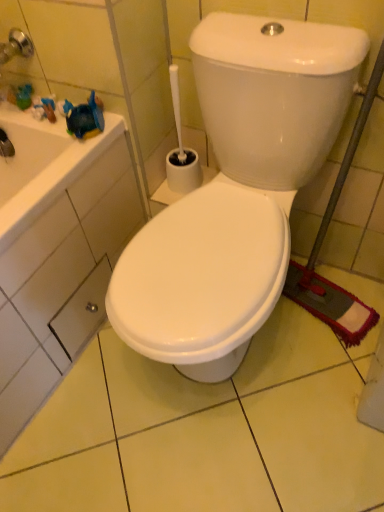
At what (x,y) coordinates should I click in order to perform the action: click on metallic silver drawer at lower left. Please return your answer as a coordinate pair (x, y). The width and height of the screenshot is (384, 512). Looking at the image, I should click on (82, 311).

What do you see at coordinates (82, 311) in the screenshot? I see `metallic silver drawer at lower left` at bounding box center [82, 311].

Locate an element on the screen. The image size is (384, 512). white glossy toilet at center is located at coordinates (236, 191).

What do you see at coordinates (236, 191) in the screenshot? I see `white glossy toilet at center` at bounding box center [236, 191].

Identify the location of metallic silver drawer at lower left. (82, 311).

Considering the positions of objects metallic silver drawer at lower left and white glossy toilet at center in the image provided, who is more to the right, metallic silver drawer at lower left or white glossy toilet at center?

white glossy toilet at center.

Is the depth of metallic silver drawer at lower left greater than that of white glossy toilet at center?

Yes, metallic silver drawer at lower left is further from the viewer.

Which point is more forward, (87, 288) or (266, 244)?

The point (266, 244) is closer to the camera.

From the image's perspective, is metallic silver drawer at lower left located above or below white glossy toilet at center?

metallic silver drawer at lower left is below white glossy toilet at center.

From a real-world perspective, is metallic silver drawer at lower left located higher than white glossy toilet at center?

Actually, metallic silver drawer at lower left is physically below white glossy toilet at center in the real world.

Between metallic silver drawer at lower left and white glossy toilet at center, which one has smaller width?

Thinner between the two is metallic silver drawer at lower left.

Can you confirm if metallic silver drawer at lower left is shorter than white glossy toilet at center?

Yes, metallic silver drawer at lower left is shorter than white glossy toilet at center.

Consider the image. Considering the relative sizes of metallic silver drawer at lower left and white glossy toilet at center in the image provided, is metallic silver drawer at lower left bigger than white glossy toilet at center?

No.

Is metallic silver drawer at lower left not within white glossy toilet at center?

Yes, metallic silver drawer at lower left is located beyond the bounds of white glossy toilet at center.

From the picture: Is metallic silver drawer at lower left placed right next to white glossy toilet at center?

No, metallic silver drawer at lower left is not with white glossy toilet at center.

Looking at this image, is metallic silver drawer at lower left looking in the opposite direction of white glossy toilet at center?

metallic silver drawer at lower left does not have its back to white glossy toilet at center.

What's the angular difference between metallic silver drawer at lower left and white glossy toilet at center's facing directions?

They differ by 88.9 degrees in their facing directions.

How far apart are metallic silver drawer at lower left and white glossy toilet at center?

18.16 inches.

The width and height of the screenshot is (384, 512). Identify the location of toilet lying above the metallic silver drawer at lower left (from the image's perspective). (236, 191).

Considering the positions of objects white glossy toilet at center and metallic silver drawer at lower left in the image provided, who is more to the right, white glossy toilet at center or metallic silver drawer at lower left?

Positioned to the right is white glossy toilet at center.

Is white glossy toilet at center behind metallic silver drawer at lower left?

No, the depth of white glossy toilet at center is less than that of metallic silver drawer at lower left.

Which is behind, point (268, 251) or point (81, 287)?

The point (81, 287) is farther.

From the image's perspective, which one is positioned higher, white glossy toilet at center or metallic silver drawer at lower left?

white glossy toilet at center is shown above in the image.

From a real-world perspective, is white glossy toilet at center located higher than metallic silver drawer at lower left?

Indeed, from a real-world perspective, white glossy toilet at center stands above metallic silver drawer at lower left.

Considering the relative sizes of white glossy toilet at center and metallic silver drawer at lower left in the image provided, is white glossy toilet at center wider than metallic silver drawer at lower left?

Correct, the width of white glossy toilet at center exceeds that of metallic silver drawer at lower left.

Between white glossy toilet at center and metallic silver drawer at lower left, which one has less height?

With less height is metallic silver drawer at lower left.

Does white glossy toilet at center have a larger size compared to metallic silver drawer at lower left?

Correct, white glossy toilet at center is larger in size than metallic silver drawer at lower left.

Is white glossy toilet at center outside of metallic silver drawer at lower left?

Yes, white glossy toilet at center is not within metallic silver drawer at lower left.

Is white glossy toilet at center next to metallic silver drawer at lower left?

white glossy toilet at center and metallic silver drawer at lower left are clearly separated.

Is white glossy toilet at center facing away from metallic silver drawer at lower left?

white glossy toilet at center is not turned away from metallic silver drawer at lower left.

How different are the orientations of white glossy toilet at center and metallic silver drawer at lower left in degrees?

white glossy toilet at center and metallic silver drawer at lower left are facing 88.9 degrees away from each other.

How much distance is there between white glossy toilet at center and metallic silver drawer at lower left?

They are 46.12 centimeters apart.

Image resolution: width=384 pixels, height=512 pixels. In order to click on drawer behind the white glossy toilet at center in this screenshot , I will do `click(82, 311)`.

The height and width of the screenshot is (512, 384). What are the coordinates of `drawer below the white glossy toilet at center (from a real-world perspective)` in the screenshot? It's located at (82, 311).

At what (x,y) coordinates should I click in order to perform the action: click on toilet above the metallic silver drawer at lower left (from the image's perspective). Please return your answer as a coordinate pair (x, y). The image size is (384, 512). Looking at the image, I should click on (236, 191).